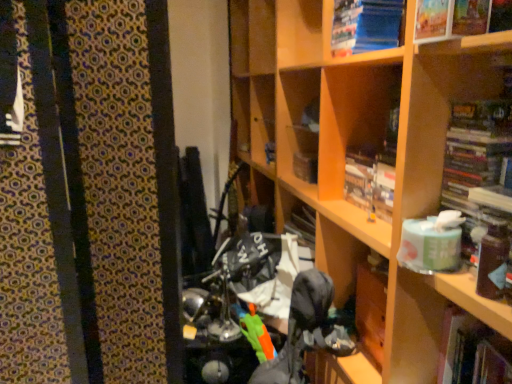
Question: Can you confirm if hardcover book at lower right, marked as the fifth book in a top-to-bottom arrangement, is bigger than hardcover book at right, which appears as the second book when ordered from the bottom?

Choices:
 (A) no
 (B) yes

Answer: (B)

Question: From the image's perspective, is hardcover book at lower right, marked as the fifth book in a top-to-bottom arrangement, on top of hardcover book at right, which appears as the second book when ordered from the bottom?

Choices:
 (A) no
 (B) yes

Answer: (A)

Question: Is hardcover book at lower right, marked as the fifth book in a top-to-bottom arrangement, positioned before hardcover book at right, which appears as the second book when ordered from the bottom?

Choices:
 (A) no
 (B) yes

Answer: (A)

Question: Is hardcover book at lower right, marked as the fifth book in a top-to-bottom arrangement, further to camera compared to hardcover book at right, which is counted as the fourth book, starting from the top?

Choices:
 (A) no
 (B) yes

Answer: (B)

Question: Is hardcover book at lower right, marked as the fifth book in a top-to-bottom arrangement, next to hardcover book at right, which appears as the second book when ordered from the bottom, and touching it?

Choices:
 (A) yes
 (B) no

Answer: (B)

Question: Is hardcover book at right, which appears as the second book when ordered from the bottom, in front of or behind matte paper book at upper right, positioned as the 4th book in bottom-to-top order, in the image?

Choices:
 (A) behind
 (B) front

Answer: (A)

Question: Does point (488, 144) appear closer or farther from the camera than point (417, 21)?

Choices:
 (A) closer
 (B) farther

Answer: (B)

Question: From the image's perspective, is hardcover book at right, which is counted as the fourth book, starting from the top, positioned above or below matte paper book at upper right, positioned as the 4th book in bottom-to-top order?

Choices:
 (A) above
 (B) below

Answer: (B)

Question: Is hardcover book at right, which is counted as the fourth book, starting from the top, situated inside matte paper book at upper right, positioned as the 4th book in bottom-to-top order, or outside?

Choices:
 (A) outside
 (B) inside

Answer: (A)

Question: Considering the positions of matte paper book at upper right, which ranks as the 2th book in top-to-bottom order, and hardcover book at upper center, which appears as the third book when ordered from the bottom, in the image, is matte paper book at upper right, which ranks as the 2th book in top-to-bottom order, wider or thinner than hardcover book at upper center, which appears as the third book when ordered from the bottom,?

Choices:
 (A) thin
 (B) wide

Answer: (B)

Question: From a real-world perspective, is matte paper book at upper right, which ranks as the 2th book in top-to-bottom order, physically located above or below hardcover book at upper center, the third book positioned from the top?

Choices:
 (A) below
 (B) above

Answer: (B)

Question: Considering their positions, is matte paper book at upper right, positioned as the 4th book in bottom-to-top order, located in front of or behind hardcover book at upper center, which appears as the third book when ordered from the bottom?

Choices:
 (A) behind
 (B) front

Answer: (B)

Question: In terms of height, does matte paper book at upper right, positioned as the 4th book in bottom-to-top order, look taller or shorter compared to hardcover book at upper center, the third book positioned from the top?

Choices:
 (A) tall
 (B) short

Answer: (B)

Question: Considering the relative positions of blue paper at upper right, which appears as the 1th book when viewed from the top, and hardcover book at right, which appears as the second book when ordered from the bottom, in the image provided, is blue paper at upper right, which appears as the 1th book when viewed from the top, to the left or to the right of hardcover book at right, which appears as the second book when ordered from the bottom,?

Choices:
 (A) left
 (B) right

Answer: (A)

Question: From the image's perspective, is blue paper at upper right, arranged as the 5th book when ordered from the bottom, located above or below hardcover book at right, which appears as the second book when ordered from the bottom?

Choices:
 (A) above
 (B) below

Answer: (A)